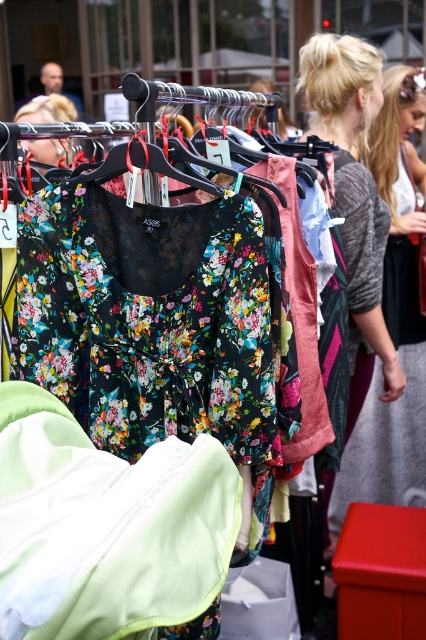
Question: Is light green fabric at lower left smaller than gray knit sweater at center?

Choices:
 (A) no
 (B) yes

Answer: (B)

Question: Which point is closer to the camera?

Choices:
 (A) light green fabric at lower left
 (B) gray knit sweater at center

Answer: (A)

Question: Which point is farther to the camera?

Choices:
 (A) (377, 465)
 (B) (13, 449)

Answer: (A)

Question: Does light green fabric at lower left appear over gray knit sweater at center?

Choices:
 (A) no
 (B) yes

Answer: (A)

Question: Where is light green fabric at lower left located in relation to gray knit sweater at center in the image?

Choices:
 (A) below
 (B) above

Answer: (A)